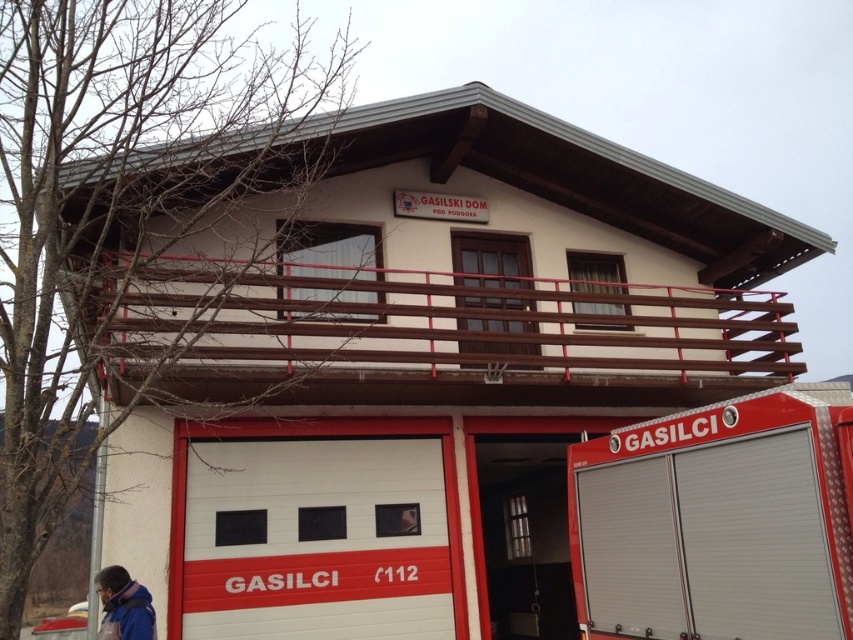
Looking at this image, you are a firefighter standing at the entrance of the garage door. You need to reach the metallic silver fire truck at lower right quickly. There is a blue fabric jacket at lower left in your path. Is there enough space between them for you to walk through safely?

The distance between the metallic silver fire truck at lower right and blue fabric jacket at lower left is 3.88 meters, which is sufficient for a firefighter to walk through safely.

You are standing in front of the building and want to take a photo. You notice two points marked on the building. Which point, point (753,557) or point (149,604), will appear larger in your photo?

Point (753,557) is closer to the camera than point (149,604), so it will appear larger in the photo.

You are a firefighter standing in front of the building. You need to quickly grab your jacket before getting into the fire truck. Which item is closer to you, the metallic silver fire truck at lower right or the blue fabric jacket at lower left?

The metallic silver fire truck at lower right is closer to the viewer than the blue fabric jacket at lower left, so you should reach for the metallic silver fire truck at lower right first.